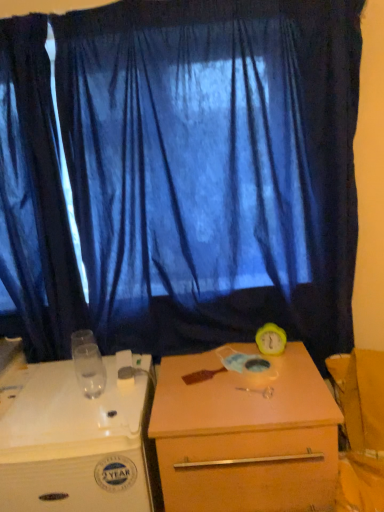
Describe the element at coordinates (76, 442) in the screenshot. I see `white plastic desk at lower left, the 1th desk in the left-to-right sequence` at that location.

Locate an element on the screen. white plastic desk at lower left, the second desk positioned from the right is located at coordinates (76, 442).

Can you confirm if yellow rubber alarm clock at right is shorter than dark blue fabric curtain at left, which is counted as the second curtain, starting from the right?

Correct, yellow rubber alarm clock at right is not as tall as dark blue fabric curtain at left, which is counted as the second curtain, starting from the right.

Is yellow rubber alarm clock at right at the right side of dark blue fabric curtain at left, which is counted as the second curtain, starting from the right?

Yes.

Starting from the yellow rubber alarm clock at right, which curtain is the 1st one in front? Please provide its 2D coordinates.

[(35, 197)]

From a real-world perspective, does yellow rubber alarm clock at right stand above dark blue fabric curtain at left, which is counted as the second curtain, starting from the right?

No, from a real-world perspective, yellow rubber alarm clock at right is not over dark blue fabric curtain at left, which is counted as the second curtain, starting from the right

Do you think dark blue fabric curtain at left, which is counted as the second curtain, starting from the right, is within blue fabric curtain at center, the second curtain when ordered from left to right, or outside of it?

dark blue fabric curtain at left, which is counted as the second curtain, starting from the right, exists outside the volume of blue fabric curtain at center, the second curtain when ordered from left to right.

Looking at the image, does dark blue fabric curtain at left, which is counted as the 1th curtain, starting from the left, seem bigger or smaller compared to blue fabric curtain at center, the second curtain when ordered from left to right?

Considering their sizes, dark blue fabric curtain at left, which is counted as the 1th curtain, starting from the left, takes up less space than blue fabric curtain at center, the second curtain when ordered from left to right.

From the image's perspective, between dark blue fabric curtain at left, which is counted as the 1th curtain, starting from the left, and matte wooden desk at center, the second desk positioned from the left, which one is located above?

dark blue fabric curtain at left, which is counted as the 1th curtain, starting from the left, is shown above in the image.

Image resolution: width=384 pixels, height=512 pixels. Identify the location of desk that is the 1st one when counting forward from the dark blue fabric curtain at left, which is counted as the 1th curtain, starting from the left. (245, 435).

Between dark blue fabric curtain at left, which is counted as the second curtain, starting from the right, and matte wooden desk at center, the second desk positioned from the left, which one has smaller width?

Thinner between the two is dark blue fabric curtain at left, which is counted as the second curtain, starting from the right.

Is dark blue fabric curtain at left, which is counted as the second curtain, starting from the right, located outside matte wooden desk at center, the second desk positioned from the left?

dark blue fabric curtain at left, which is counted as the second curtain, starting from the right, is positioned outside matte wooden desk at center, the second desk positioned from the left.

Is matte wooden desk at center, the second desk positioned from the left, smaller than white plastic desk at lower left, the 1th desk in the left-to-right sequence?

Incorrect, matte wooden desk at center, the second desk positioned from the left, is not smaller in size than white plastic desk at lower left, the 1th desk in the left-to-right sequence.

Based on the photo, from the image's perspective, between matte wooden desk at center, the second desk positioned from the left, and white plastic desk at lower left, the second desk positioned from the right, which one is located above?

From the image's view, matte wooden desk at center, the second desk positioned from the left, is above.

Is matte wooden desk at center, the second desk positioned from the left, shorter than white plastic desk at lower left, the second desk positioned from the right?

In fact, matte wooden desk at center, the second desk positioned from the left, may be taller than white plastic desk at lower left, the second desk positioned from the right.

Is point (196, 505) positioned before point (87, 476)?

No, (196, 505) is behind (87, 476).

From the picture: Which of these two, blue fabric curtain at center, positioned as the 1th curtain in right-to-left order, or yellow rubber alarm clock at right, stands taller?

Standing taller between the two is blue fabric curtain at center, positioned as the 1th curtain in right-to-left order.

From a real-world perspective, which is physically above, blue fabric curtain at center, the second curtain when ordered from left to right, or yellow rubber alarm clock at right?

blue fabric curtain at center, the second curtain when ordered from left to right, is physically above.

Based on the photo, which point is more forward, (50,122) or (267,338)?

Point (50,122)

Which is correct: white plastic desk at lower left, the second desk positioned from the right, is inside dark blue fabric curtain at left, which is counted as the second curtain, starting from the right, or outside of it?

white plastic desk at lower left, the second desk positioned from the right, is not inside dark blue fabric curtain at left, which is counted as the second curtain, starting from the right, it's outside.

Between white plastic desk at lower left, the second desk positioned from the right, and dark blue fabric curtain at left, which is counted as the second curtain, starting from the right, which one has larger width?

Wider between the two is white plastic desk at lower left, the second desk positioned from the right.

Between white plastic desk at lower left, the second desk positioned from the right, and dark blue fabric curtain at left, which is counted as the 1th curtain, starting from the left, which one has larger size?

white plastic desk at lower left, the second desk positioned from the right.

Which is more to the right, white plastic desk at lower left, the 1th desk in the left-to-right sequence, or dark blue fabric curtain at left, which is counted as the second curtain, starting from the right?

Positioned to the right is white plastic desk at lower left, the 1th desk in the left-to-right sequence.

Which point is more forward, (x=64, y=293) or (x=133, y=379)?

The point (x=133, y=379) is closer.

Considering the relative positions of dark blue fabric curtain at left, which is counted as the 1th curtain, starting from the left, and white plastic desk at lower left, the second desk positioned from the right, in the image provided, is dark blue fabric curtain at left, which is counted as the 1th curtain, starting from the left, to the left of white plastic desk at lower left, the second desk positioned from the right, from the viewer's perspective?

Yes, dark blue fabric curtain at left, which is counted as the 1th curtain, starting from the left, is to the left of white plastic desk at lower left, the second desk positioned from the right.

Do you think dark blue fabric curtain at left, which is counted as the second curtain, starting from the right, is within white plastic desk at lower left, the second desk positioned from the right, or outside of it?

The correct answer is: outside.

How many degrees apart are the facing directions of dark blue fabric curtain at left, which is counted as the second curtain, starting from the right, and white plastic desk at lower left, the second desk positioned from the right?

There is a 0.454-degree angle between the facing directions of dark blue fabric curtain at left, which is counted as the second curtain, starting from the right, and white plastic desk at lower left, the second desk positioned from the right.

Find the location of a particular element. The width and height of the screenshot is (384, 512). alarm clock on the right of the dark blue fabric curtain at left, which is counted as the second curtain, starting from the right is located at coordinates (271, 339).

Find the location of a particular element. The image size is (384, 512). curtain above the dark blue fabric curtain at left, which is counted as the second curtain, starting from the right (from the image's perspective) is located at coordinates (183, 173).

Which object lies nearer to the anchor point blue fabric curtain at center, the second curtain when ordered from left to right, yellow rubber alarm clock at right or white plastic desk at lower left, the 1th desk in the left-to-right sequence?

white plastic desk at lower left, the 1th desk in the left-to-right sequence.

Estimate the real-world distances between objects in this image. Which object is closer to matte wooden desk at center, placed as the first desk when sorted from right to left, white plastic desk at lower left, the second desk positioned from the right, or yellow rubber alarm clock at right?

Based on the image, white plastic desk at lower left, the second desk positioned from the right, appears to be nearer to matte wooden desk at center, placed as the first desk when sorted from right to left.

Estimate the real-world distances between objects in this image. Which object is closer to dark blue fabric curtain at left, which is counted as the 1th curtain, starting from the left, matte wooden desk at center, the second desk positioned from the left, or yellow rubber alarm clock at right?

Among the two, matte wooden desk at center, the second desk positioned from the left, is located nearer to dark blue fabric curtain at left, which is counted as the 1th curtain, starting from the left.

Looking at this image, which object lies nearer to the anchor point dark blue fabric curtain at left, which is counted as the 1th curtain, starting from the left, yellow rubber alarm clock at right or blue fabric curtain at center, the second curtain when ordered from left to right?

blue fabric curtain at center, the second curtain when ordered from left to right, lies closer to dark blue fabric curtain at left, which is counted as the 1th curtain, starting from the left, than the other object.

In the scene shown: Estimate the real-world distances between objects in this image. Which object is further from matte wooden desk at center, placed as the first desk when sorted from right to left, dark blue fabric curtain at left, which is counted as the second curtain, starting from the right, or yellow rubber alarm clock at right?

dark blue fabric curtain at left, which is counted as the second curtain, starting from the right, is positioned further to the anchor matte wooden desk at center, placed as the first desk when sorted from right to left.

Considering their positions, is white plastic desk at lower left, the second desk positioned from the right, positioned closer to matte wooden desk at center, the second desk positioned from the left, than dark blue fabric curtain at left, which is counted as the 1th curtain, starting from the left?

white plastic desk at lower left, the second desk positioned from the right.

Estimate the real-world distances between objects in this image. Which object is closer to matte wooden desk at center, the second desk positioned from the left, blue fabric curtain at center, positioned as the 1th curtain in right-to-left order, or dark blue fabric curtain at left, which is counted as the 1th curtain, starting from the left?

Based on the image, blue fabric curtain at center, positioned as the 1th curtain in right-to-left order, appears to be nearer to matte wooden desk at center, the second desk positioned from the left.

Based on their spatial positions, is blue fabric curtain at center, the second curtain when ordered from left to right, or matte wooden desk at center, placed as the first desk when sorted from right to left, closer to white plastic desk at lower left, the second desk positioned from the right?

matte wooden desk at center, placed as the first desk when sorted from right to left, is positioned closer to the anchor white plastic desk at lower left, the second desk positioned from the right.

Where is `curtain between blue fabric curtain at center, the second curtain when ordered from left to right, and white plastic desk at lower left, the second desk positioned from the right, in the up-down direction`? curtain between blue fabric curtain at center, the second curtain when ordered from left to right, and white plastic desk at lower left, the second desk positioned from the right, in the up-down direction is located at coordinates (35, 197).

Identify the location of desk between white plastic desk at lower left, the 1th desk in the left-to-right sequence, and yellow rubber alarm clock at right. This screenshot has width=384, height=512. click(x=245, y=435).

Image resolution: width=384 pixels, height=512 pixels. Identify the location of desk between blue fabric curtain at center, the second curtain when ordered from left to right, and white plastic desk at lower left, the second desk positioned from the right, in the vertical direction. [x=245, y=435].

Identify the location of alarm clock between blue fabric curtain at center, the second curtain when ordered from left to right, and white plastic desk at lower left, the second desk positioned from the right, from top to bottom. (271, 339).